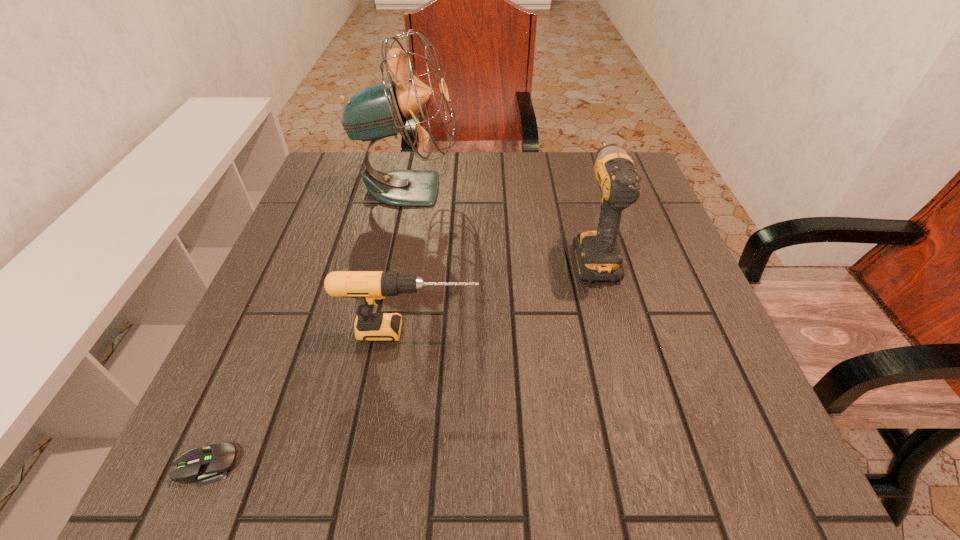
Image resolution: width=960 pixels, height=540 pixels. In order to click on vacant space that satisfies the following two spatial constraints: 1. on the front-facing side of the farthest object for air flow; 2. with the drill bit of the right drill facing forward in this screenshot , I will do `click(395, 254)`.